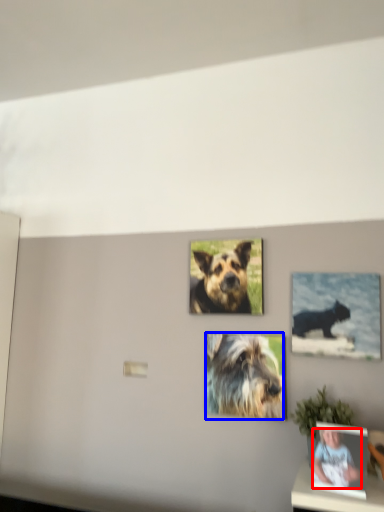
Question: Which object is closer to the camera taking this photo, person (highlighted by a red box) or dog (highlighted by a blue box)?

Choices:
 (A) person
 (B) dog

Answer: (A)